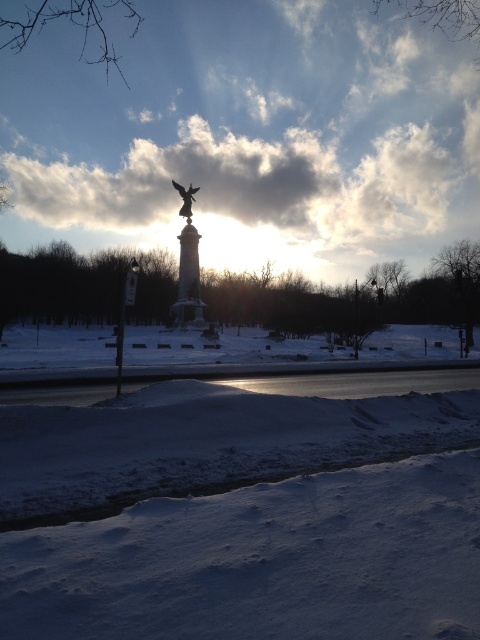
Does white fluffy cloud at upper center have a lesser height compared to smooth stone pillar at center?

In fact, white fluffy cloud at upper center may be taller than smooth stone pillar at center.

Who is lower down, white fluffy cloud at upper center or smooth stone pillar at center?

smooth stone pillar at center

Is point (368, 10) positioned in front of point (187, 250)?

No.

The image size is (480, 640). What are the coordinates of `white fluffy cloud at upper center` in the screenshot? It's located at (248, 134).

Between white powdery snow at center and metallic pole at left, which one appears on the right side from the viewer's perspective?

From the viewer's perspective, white powdery snow at center appears more on the right side.

Is point (218, 516) positioned after point (132, 276)?

No, (218, 516) is in front of (132, 276).

You are a GUI agent. You are given a task and a screenshot of the screen. Output one action in this format:
    pyautogui.click(x=<x>, y=<y>)
    Task: Click on the white powdery snow at center
    
    Given the screenshot: What is the action you would take?
    (x=244, y=512)

Does metallic pole at left have a greater height compared to sculpted gold angel at center?

Yes.

Is metallic pole at left positioned before sculpted gold angel at center?

That is True.

I want to click on metallic pole at left, so click(124, 314).